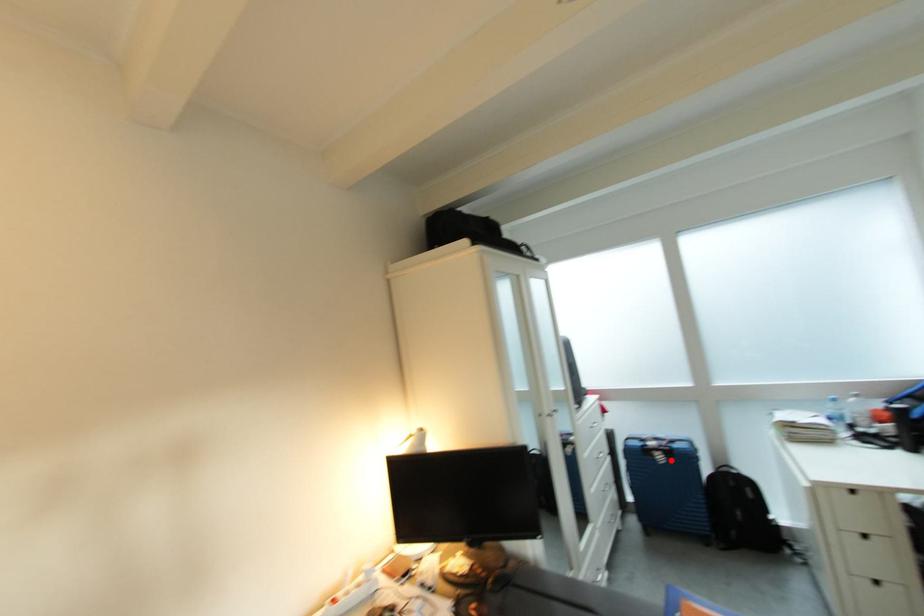
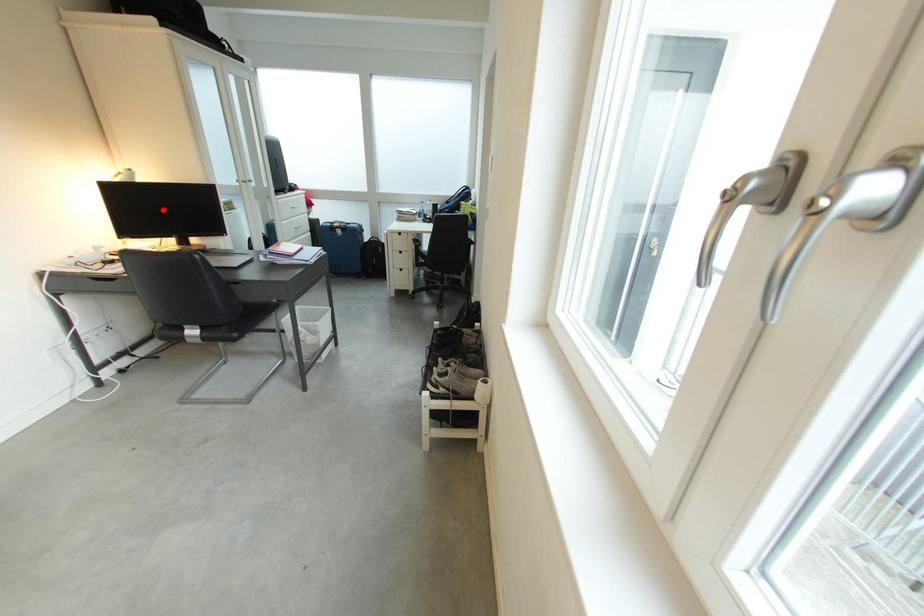
I am providing you with two images of the same scene from different viewpoints. A red point is marked on the first image and another point is marked on the second image. Do the highlighted points in image1 and image2 indicate the same real-world spot?

No